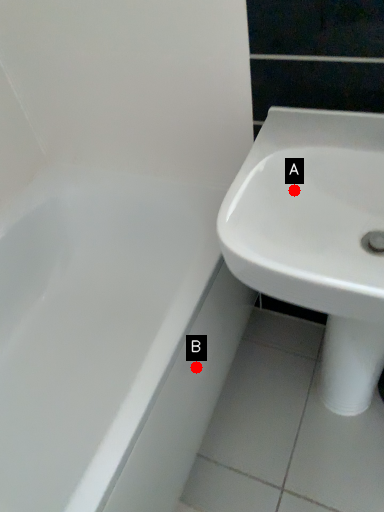
Question: Two points are circled on the image, labeled by A and B beside each circle. Which of the following is the farthest from the observer?

Choices:
 (A) A is further
 (B) B is further

Answer: (B)